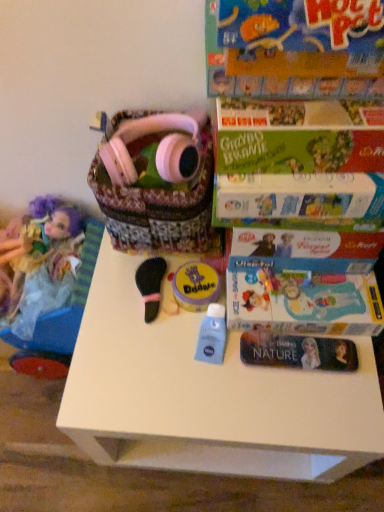
Question: From a real-world perspective, is matte purple doll at left physically below pink matte headphones at upper center?

Choices:
 (A) yes
 (B) no

Answer: (A)

Question: Is the depth of matte purple doll at left greater than that of pink matte headphones at upper center?

Choices:
 (A) no
 (B) yes

Answer: (B)

Question: Is the position of matte purple doll at left less distant than that of pink matte headphones at upper center?

Choices:
 (A) yes
 (B) no

Answer: (B)

Question: Can you confirm if matte purple doll at left is smaller than pink matte headphones at upper center?

Choices:
 (A) yes
 (B) no

Answer: (B)

Question: Is matte purple doll at left to the right of pink matte headphones at upper center from the viewer's perspective?

Choices:
 (A) no
 (B) yes

Answer: (A)

Question: Does matte purple doll at left appear on the left side of pink matte headphones at upper center?

Choices:
 (A) yes
 (B) no

Answer: (A)

Question: From a real-world perspective, is green cardboard book at upper right, which appears as the 1th paperback book when viewed from the front, beneath matte purple doll at left?

Choices:
 (A) no
 (B) yes

Answer: (A)

Question: Is green cardboard book at upper right, which appears as the 1th paperback book when viewed from the front, outside matte purple doll at left?

Choices:
 (A) no
 (B) yes

Answer: (B)

Question: Does green cardboard book at upper right, acting as the 2th paperback book starting from the back, appear on the left side of matte purple doll at left?

Choices:
 (A) yes
 (B) no

Answer: (B)

Question: From the image's perspective, would you say green cardboard book at upper right, acting as the 2th paperback book starting from the back, is shown under matte purple doll at left?

Choices:
 (A) no
 (B) yes

Answer: (A)

Question: Is green cardboard book at upper right, which appears as the 1th paperback book when viewed from the front, surrounding matte purple doll at left?

Choices:
 (A) no
 (B) yes

Answer: (A)

Question: Can you confirm if green cardboard book at upper right, acting as the 2th paperback book starting from the back, is shorter than matte purple doll at left?

Choices:
 (A) no
 (B) yes

Answer: (B)

Question: Considering the relative sizes of green cardboard book at upper right, acting as the 2th paperback book starting from the back, and black felt brush at center, which is the 1th toy in left-to-right order, in the image provided, is green cardboard book at upper right, acting as the 2th paperback book starting from the back, taller than black felt brush at center, which is the 1th toy in left-to-right order,?

Choices:
 (A) yes
 (B) no

Answer: (A)